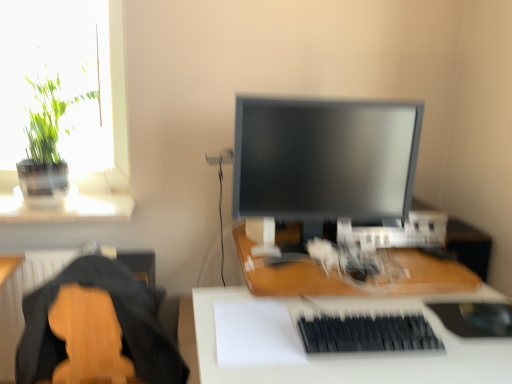
Where is `vacant space situated above white matte desk at center, which is counted as the first desk, starting from the bottom (from a real-world perspective)`? The image size is (512, 384). vacant space situated above white matte desk at center, which is counted as the first desk, starting from the bottom (from a real-world perspective) is located at coordinates (398, 317).